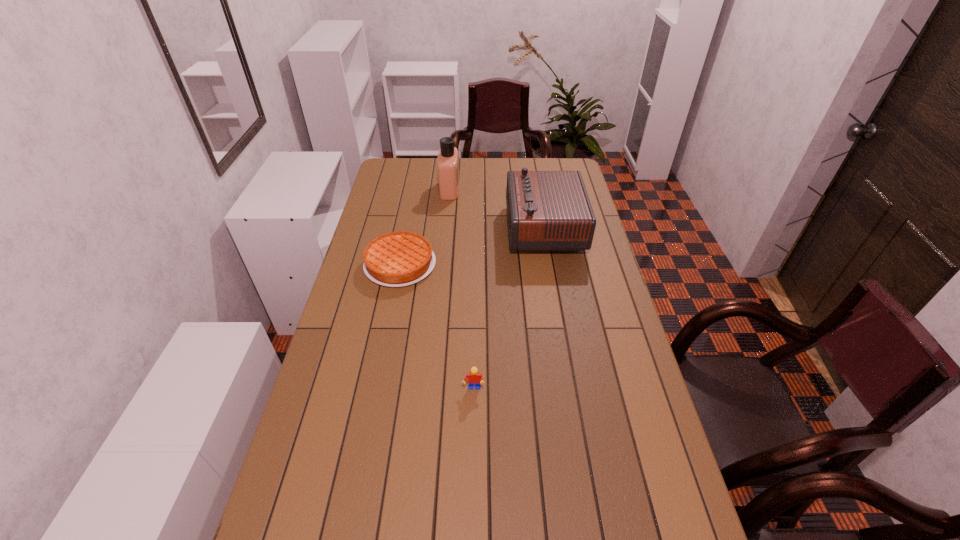
Find the location of a particular element. The image size is (960, 540). vacant area between the pie and the Lego is located at coordinates (437, 327).

This screenshot has height=540, width=960. I want to click on empty space between the Lego and the shortest object, so tap(437, 327).

Identify the location of free space between the third shortest object and the perfume. The height and width of the screenshot is (540, 960). (497, 208).

In order to click on blank region between the tallest object and the Lego in this screenshot , I will do `click(462, 289)`.

This screenshot has width=960, height=540. What are the coordinates of `vacant area that lies between the pie and the radio receiver` in the screenshot? It's located at (472, 246).

Where is `empty space between the pie and the tallest object`? This screenshot has height=540, width=960. empty space between the pie and the tallest object is located at coordinates (425, 227).

Image resolution: width=960 pixels, height=540 pixels. I want to click on free space between the radio receiver and the second object from right to left, so click(x=509, y=308).

Select which object is the third closest to the third tallest object. Please provide its 2D coordinates. Your answer should be formatted as a tuple, i.e. [(x, y)], where the tuple contains the x and y coordinates of a point satisfying the conditions above.

[(447, 162)]

Choose which object is the second nearest neighbor to the shortest object. Please provide its 2D coordinates. Your answer should be formatted as a tuple, i.e. [(x, y)], where the tuple contains the x and y coordinates of a point satisfying the conditions above.

[(447, 162)]

Find the location of a particular element. This screenshot has height=540, width=960. free region that satisfies the following two spatial constraints: 1. on the front panel of the rightmost object; 2. on the front-facing side of the second object from right to left is located at coordinates (572, 389).